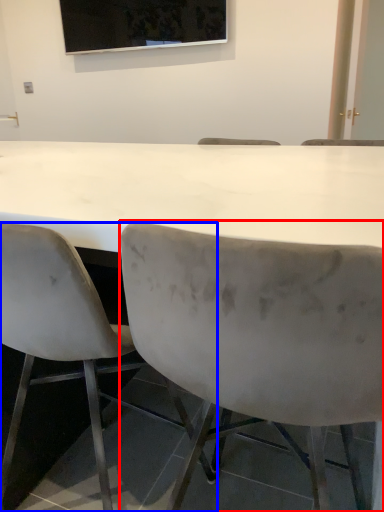
Question: Which point is further to the camera, chair (highlighted by a red box) or chair (highlighted by a blue box)?

Choices:
 (A) chair
 (B) chair

Answer: (B)